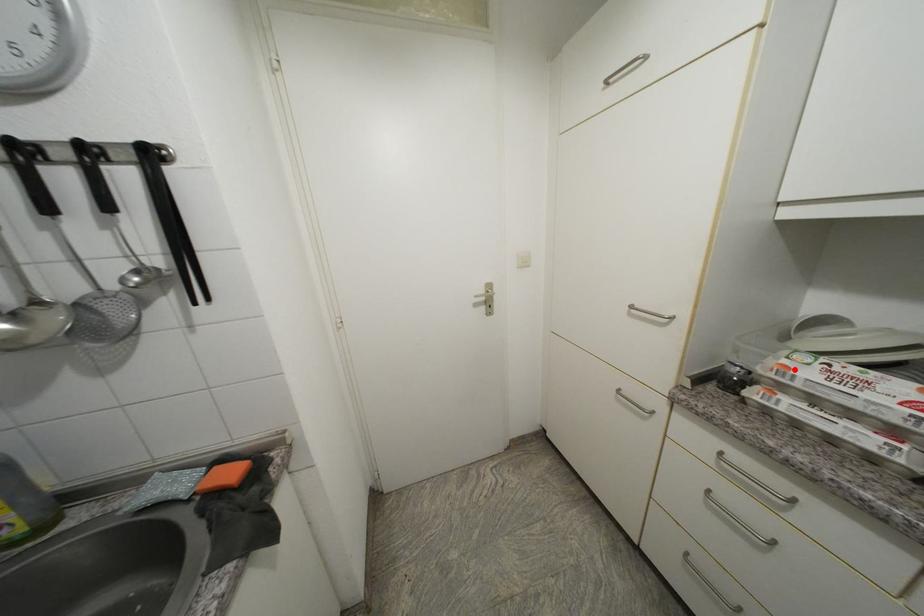
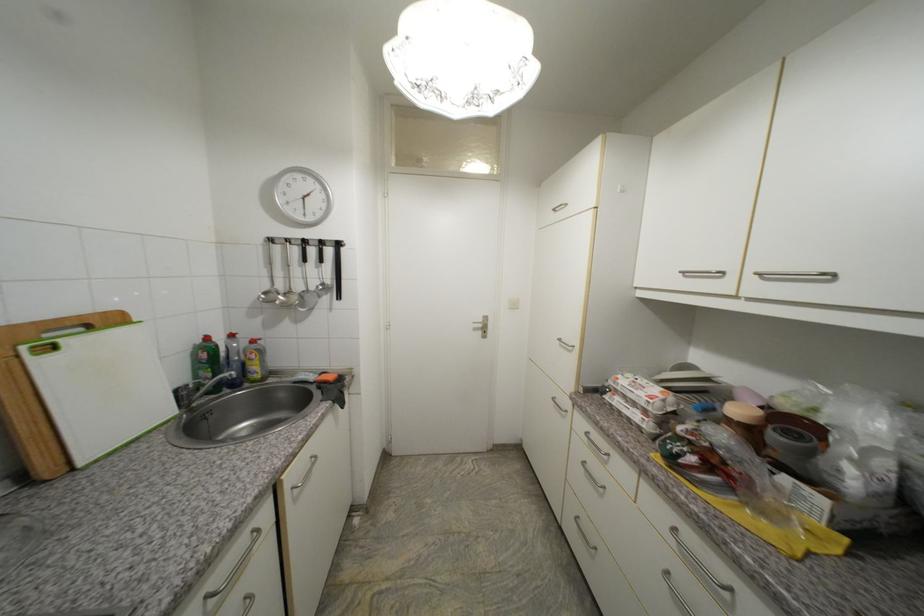
Where in the second image is the point corresponding to the highlighted location from the first image?

(623, 379)